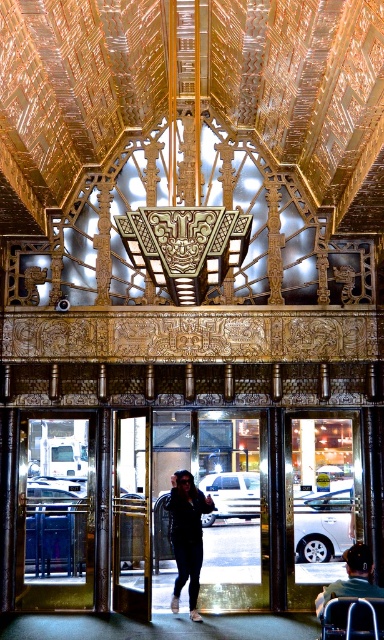
Can you confirm if transparent glass door at left is taller than dark gray fabric wheelchair at lower right?

Indeed, transparent glass door at left has a greater height compared to dark gray fabric wheelchair at lower right.

Does transparent glass door at left have a smaller size compared to dark gray fabric wheelchair at lower right?

No, transparent glass door at left is not smaller than dark gray fabric wheelchair at lower right.

Which is in front, point (34, 609) or point (347, 554)?

Positioned in front is point (347, 554).

Locate an element on the screen. Image resolution: width=384 pixels, height=640 pixels. transparent glass door at left is located at coordinates (56, 513).

Is transparent glass door at left closer to camera compared to dark blue jeans at center?

That is False.

Can you confirm if transparent glass door at left is positioned below dark blue jeans at center?

No, transparent glass door at left is not below dark blue jeans at center.

This screenshot has width=384, height=640. What do you see at coordinates (56, 513) in the screenshot?
I see `transparent glass door at left` at bounding box center [56, 513].

Identify the location of transparent glass door at left. This screenshot has width=384, height=640. (56, 513).

Between point (175, 541) and point (372, 589), which one is positioned behind?

The point (175, 541) is behind.

Does dark blue jeans at center have a larger size compared to dark gray fabric wheelchair at lower right?

Indeed, dark blue jeans at center has a larger size compared to dark gray fabric wheelchair at lower right.

Between point (178, 605) and point (329, 600), which one is positioned in front?

Point (329, 600) is more forward.

At what (x,y) coordinates should I click in order to perform the action: click on dark blue jeans at center. Please return your answer as a coordinate pair (x, y). The image size is (384, 640). Looking at the image, I should click on (187, 536).